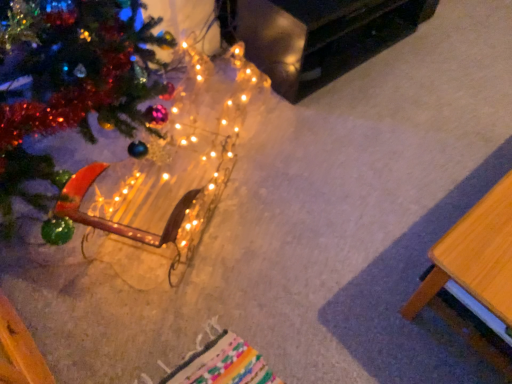
Image resolution: width=512 pixels, height=384 pixels. I want to click on empty space that is in between black glossy table at upper right, which is the first table in top-to-bottom order, and illuminated wireframe horse at lower left, so click(298, 132).